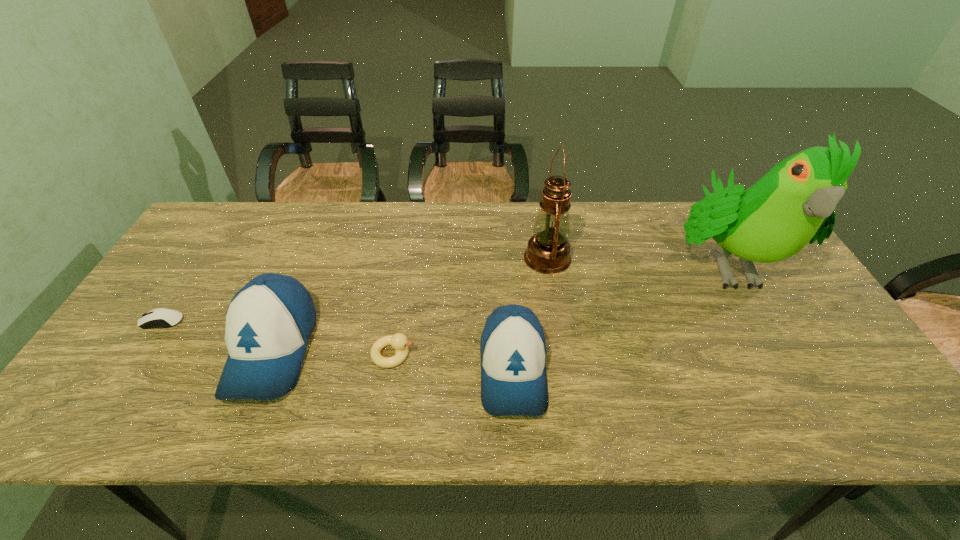
Locate an element on the screen. This screenshot has width=960, height=540. the left baseball cap is located at coordinates click(269, 321).

Where is `the fourth shortest object`? The height and width of the screenshot is (540, 960). the fourth shortest object is located at coordinates (269, 321).

At what (x,y) coordinates should I click in order to perform the action: click on the right baseball cap. Please return your answer as a coordinate pair (x, y). This screenshot has height=540, width=960. Looking at the image, I should click on (513, 351).

Find the location of a particular element. The width and height of the screenshot is (960, 540). the fourth tallest object is located at coordinates (513, 351).

The height and width of the screenshot is (540, 960). I want to click on the rightmost object, so click(x=794, y=203).

You are a GUI agent. You are given a task and a screenshot of the screen. Output one action in this format:
    pyautogui.click(x=<x>, y=<y>)
    Task: Click on the tallest object
    The image size is (960, 540).
    Given the screenshot: What is the action you would take?
    pyautogui.click(x=794, y=203)

Where is `the second tallest object`? This screenshot has width=960, height=540. the second tallest object is located at coordinates (548, 251).

Locate an element on the screen. The width and height of the screenshot is (960, 540). mouse is located at coordinates (x=161, y=317).

Locate an element on the screen. the leftmost object is located at coordinates (161, 317).

Find the location of a particular element. The image size is (960, 540). the second shortest object is located at coordinates (398, 341).